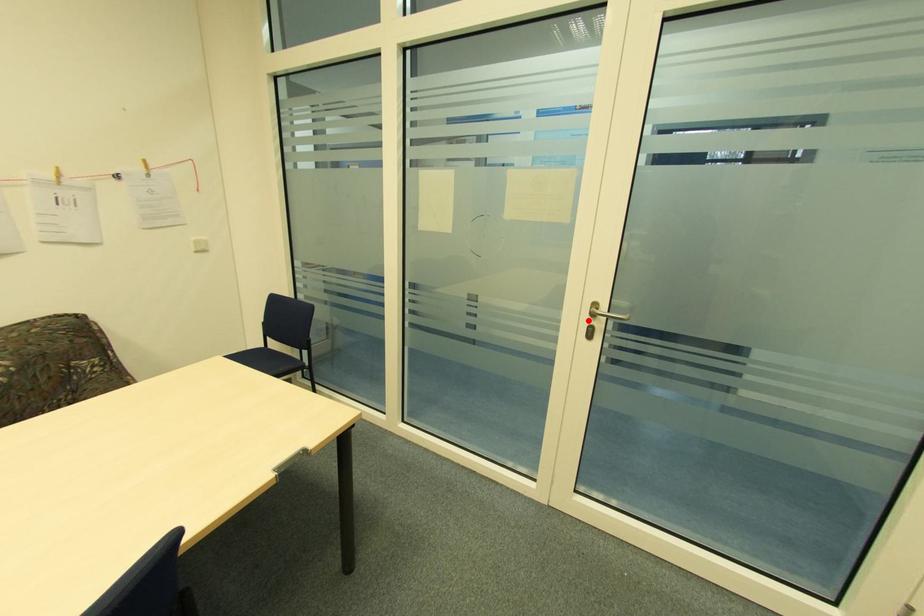
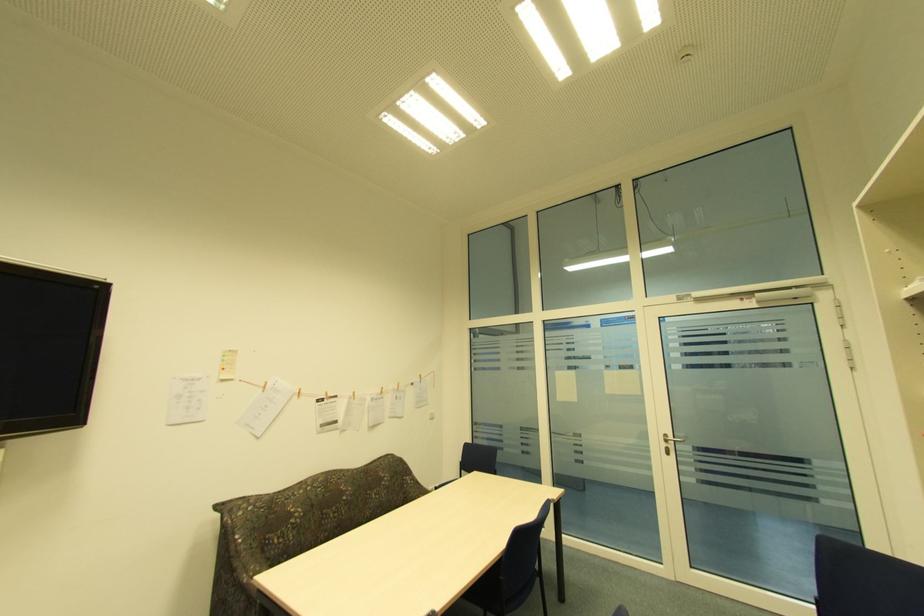
Question: A red point is marked in image1. In image2, is the corresponding 3D point closer to the camera or farther? Reply with the corresponding letter.

Choices:
 (A) The corresponding 3D point is closer.
 (B) The corresponding 3D point is farther.

Answer: (B)